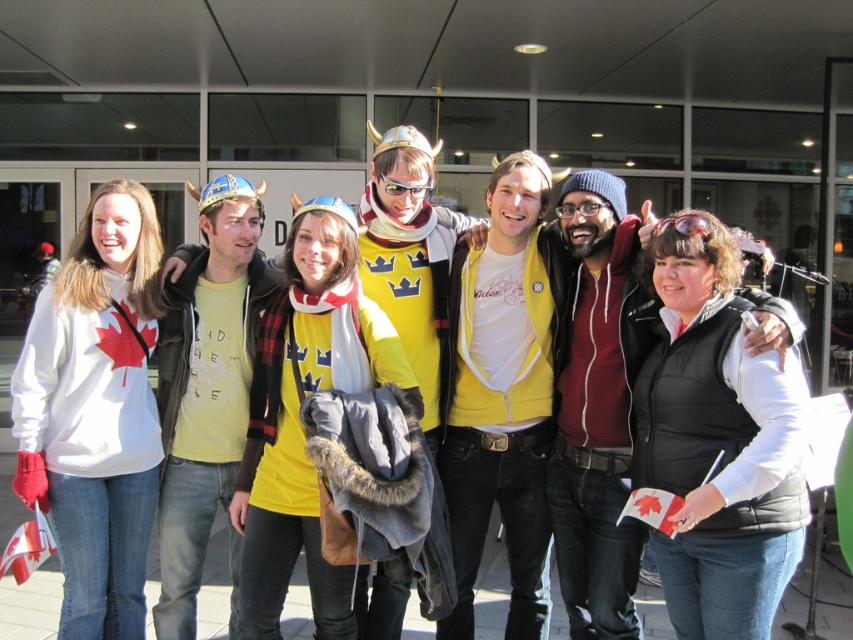
Consider the image. You are standing in front of the modern building and want to take a photo of the group. If you focus on point A at point (x=556, y=545) and point B at point (x=370, y=243), which point will appear larger in your photo?

Point A at point (x=556, y=545) will appear larger in the photo because it is closer to the camera than point B at point (x=370, y=243).

You are organizing a photo shoot and need to arrange two models wearing the matte black jacket at center and yellow matte shirt at center. Since the jackets and shirts have different widths, you want to place them side by side so that the narrower one is on the left. Which model should you place on the left?

The matte black jacket at center is thinner than the yellow matte shirt at center, so the model wearing the matte black jacket at center should be placed on the left to follow the requirement.